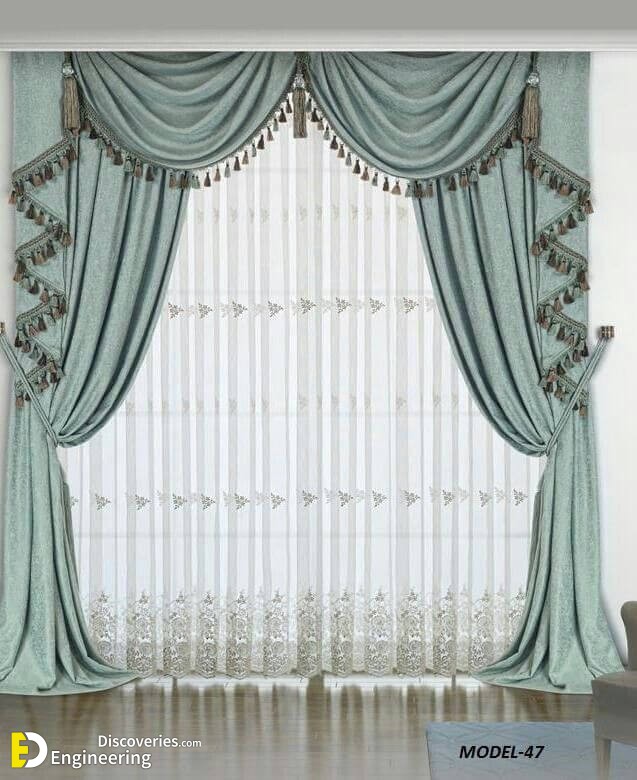
Find the location of a particular element. Image resolution: width=637 pixels, height=780 pixels. rug is located at coordinates tap(580, 747).